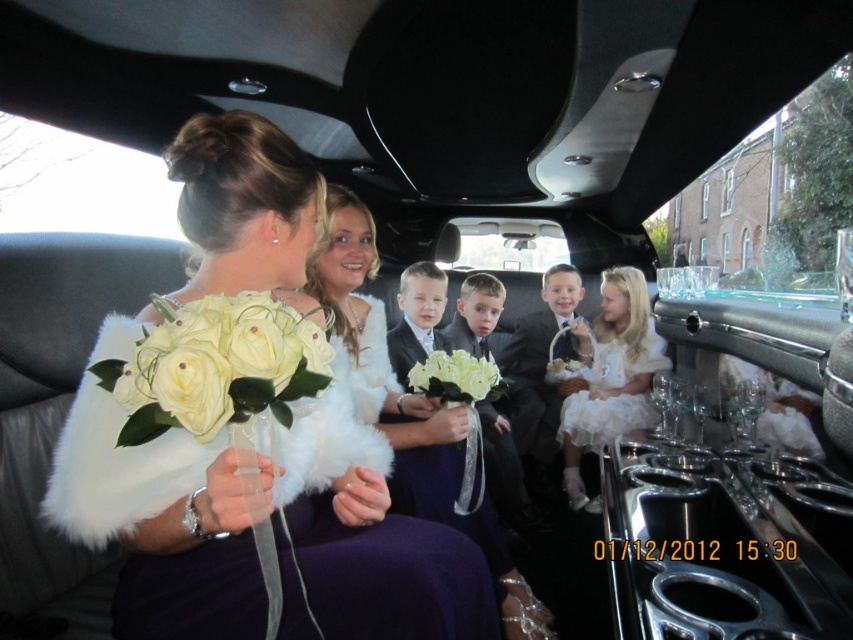
You are a photographer taking pictures inside the luxurious limousine. You need to ensure that both the white fur shawl at upper left and the white lace dress at center are clearly visible in your photo. Which object should you adjust to avoid blocking the other?

The white fur shawl at upper left is currently in front of the white lace dress at center. To ensure both are visible, you should adjust the white fur shawl at upper left so it is not blocking the white lace dress at center.

You are a photographer positioned at the center of the limousine. You need to capture a photo of the white fur shawl at upper left without moving the subject. Can you adjust your camera angle to focus on it?

The white fur shawl at upper left is located at point (160, 525) coordinates, so yes, the photographer can adjust their camera angle to focus on it without moving the subject.

You are a photographer taking pictures of the two women in the limousine. You need to ensure that both the white fur shawl at upper left and the white lace dress at center are clearly visible in the frame. Which object should you focus on first to ensure proper alignment?

The white fur shawl at upper left should be focused on first since it is positioned on the left side of the white lace dress at center, ensuring proper alignment by starting from the left.